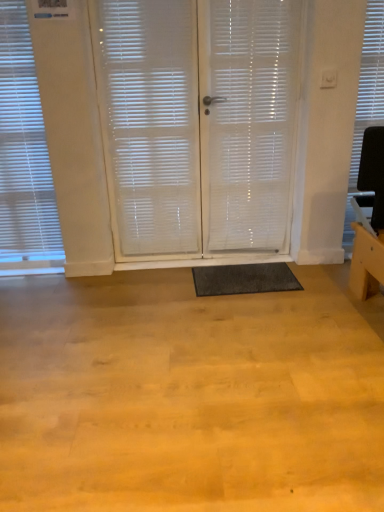
Locate an element on the screen. Image resolution: width=384 pixels, height=512 pixels. free point above dark gray rubber mat at center (from a real-world perspective) is located at coordinates (250, 274).